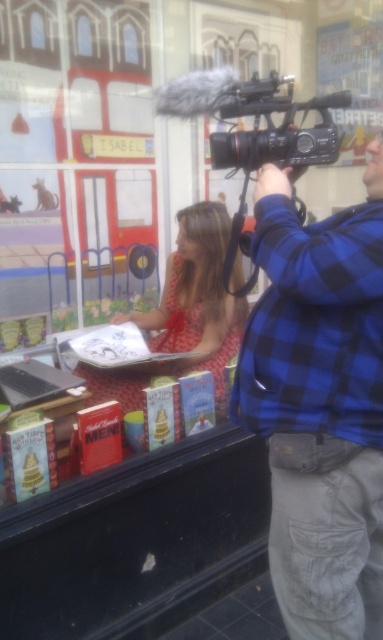
You are a photographer trying to capture a closeup of the silver metallic laptop at lower left. However, the matte red dress at center is blocking your view. Can you adjust your camera angle to see the laptop without moving any objects?

The silver metallic laptop at lower left is behind the matte red dress at center, so adjusting the camera angle to look underneath or around the dress might allow you to see the laptop without moving any objects.

You are a photographer trying to position your equipment in the scene. You have a blue checkered shirt at upper right and a black plastic video camera at upper center. Which object takes up more horizontal space in the image?

The black plastic video camera at upper center takes up more horizontal space than the blue checkered shirt at upper right because the blue checkered shirt at upper right has a lesser width compared to the black plastic video camera at upper center.